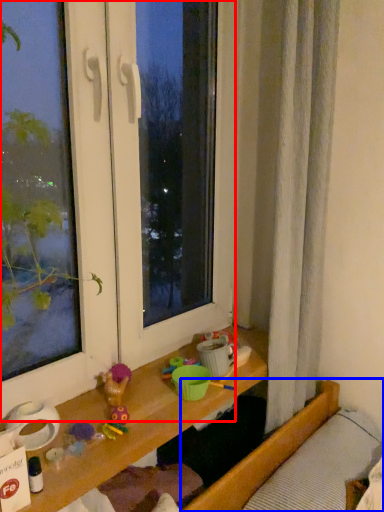
Question: Which point is closer to the camera, window (highlighted by a red box) or bed (highlighted by a blue box)?

Choices:
 (A) window
 (B) bed

Answer: (A)